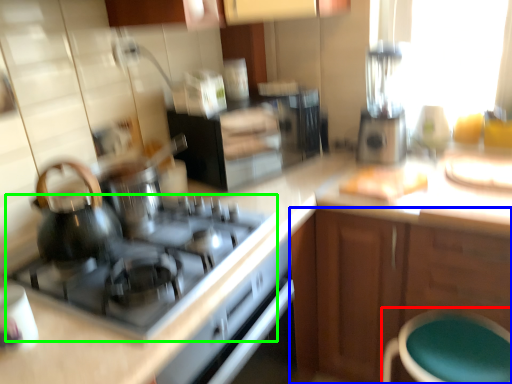
Question: Which object is the closest to the bar stool (highlighted by a red box)? Choose among these: cabinetry (highlighted by a blue box) or gas stove (highlighted by a green box).

Choices:
 (A) cabinetry
 (B) gas stove

Answer: (A)